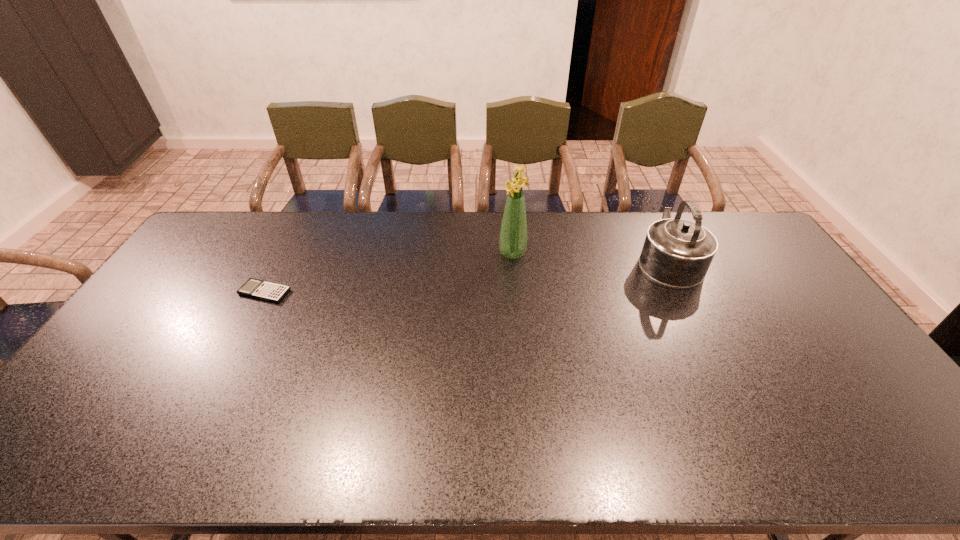
I want to click on the tallest object, so 513,235.

Locate an element on the screen. bouquet is located at coordinates (513, 235).

I want to click on kettle, so click(x=677, y=253).

Image resolution: width=960 pixels, height=540 pixels. I want to click on the rightmost object, so click(677, 253).

At what (x,y) coordinates should I click in order to perform the action: click on the shortest object. Please return your answer as a coordinate pair (x, y). Image resolution: width=960 pixels, height=540 pixels. Looking at the image, I should click on (272, 292).

You are a GUI agent. You are given a task and a screenshot of the screen. Output one action in this format:
    pyautogui.click(x=<x>, y=<y>)
    Task: Click on the leftmost object
    
    Given the screenshot: What is the action you would take?
    pyautogui.click(x=272, y=292)

Identify the location of vacant space situated 0.380m on the front-facing side of the bouquet. (391, 253).

This screenshot has width=960, height=540. Find the location of `free space located on the front-facing side of the bouquet`. free space located on the front-facing side of the bouquet is located at coordinates (485, 253).

Image resolution: width=960 pixels, height=540 pixels. I want to click on vacant space situated on the front-facing side of the bouquet, so click(399, 253).

The height and width of the screenshot is (540, 960). Find the location of `blank space located 0.120m with the spout at the front of the kettle`. blank space located 0.120m with the spout at the front of the kettle is located at coordinates (x=647, y=217).